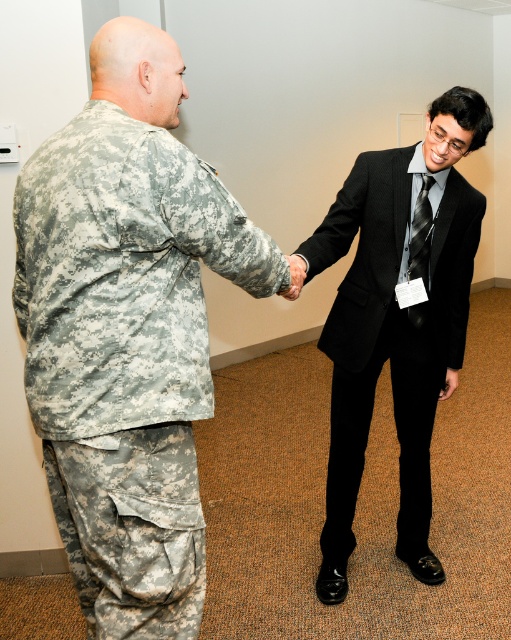
Does camouflage fabric uniform at left appear over black textured tie at center?

No.

Locate an element on the screen. This screenshot has height=640, width=511. camouflage fabric uniform at left is located at coordinates (127, 332).

Identify the location of camouflage fabric uniform at left. (127, 332).

The image size is (511, 640). I want to click on camouflage fabric uniform at left, so click(127, 332).

What do you see at coordinates (127, 332) in the screenshot?
I see `camouflage fabric uniform at left` at bounding box center [127, 332].

Locate an element on the screen. The width and height of the screenshot is (511, 640). camouflage fabric uniform at left is located at coordinates (127, 332).

Looking at this image, between black silk suit at center and black textured tie at center, which one has more height?

black silk suit at center is taller.

Who is more forward, (349, 410) or (417, 205)?

Positioned in front is point (417, 205).

Which is in front, point (384, 312) or point (413, 259)?

Positioned in front is point (413, 259).

Where is `black silk suit at center`? The width and height of the screenshot is (511, 640). black silk suit at center is located at coordinates coord(396,321).